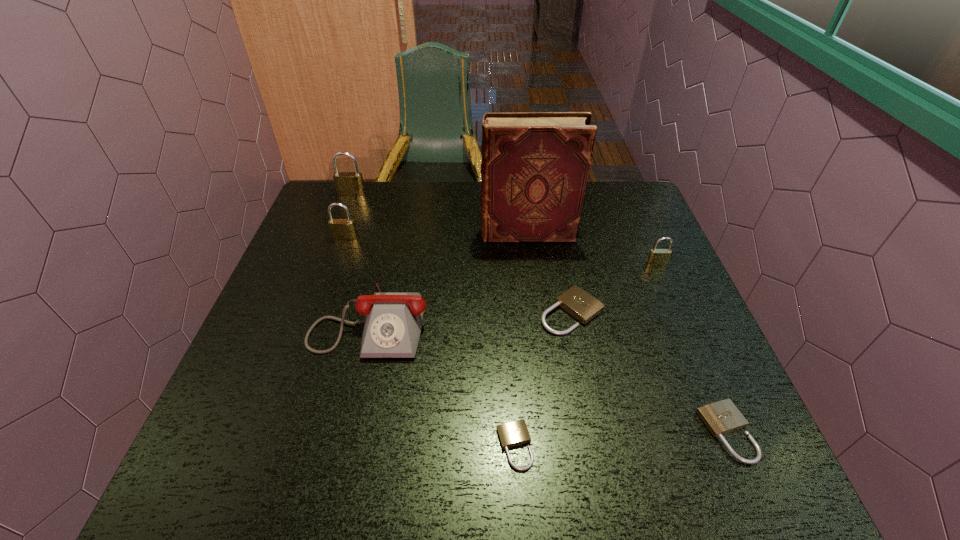
You are a GUI agent. You are given a task and a screenshot of the screen. Output one action in this format:
    pyautogui.click(x=<x>, y=<y>)
    Task: Click on the free spot between the shortest object and the telephone
    The image size is (960, 540).
    Given the screenshot: What is the action you would take?
    pyautogui.click(x=443, y=383)

Where is `vacant region between the red telephone and the leftmost beige padlock`? Image resolution: width=960 pixels, height=540 pixels. vacant region between the red telephone and the leftmost beige padlock is located at coordinates (443, 383).

Find the location of a particular element. This screenshot has height=540, width=960. free space between the second smallest brass padlock and the fourth shortest padlock is located at coordinates (501, 251).

The image size is (960, 540). Identify the location of vacant area that lies between the tallest object and the farthest padlock. (440, 214).

Where is `free spot between the red telephone and the second farthest brass padlock`? free spot between the red telephone and the second farthest brass padlock is located at coordinates (358, 279).

At what (x,y) coordinates should I click in order to perform the action: click on free space between the fourth padlock from left to right and the shortest padlock. Please return your answer as a coordinate pair (x, y). The image size is (960, 540). Looking at the image, I should click on (543, 379).

The height and width of the screenshot is (540, 960). I want to click on object that ranks as the sixth closest to the rightmost brass padlock, so click(x=341, y=229).

Identify which object is located as the sixth nearest to the fifth shortest padlock. Please provide its 2D coordinates. Your answer should be formatted as a tuple, i.e. [(x, y)], where the tuple contains the x and y coordinates of a point satisfying the conditions above.

[(657, 256)]

Where is `padlock that is the fifth closest one to the telephone`? The height and width of the screenshot is (540, 960). padlock that is the fifth closest one to the telephone is located at coordinates (721, 417).

This screenshot has width=960, height=540. What are the coordinates of `padlock that is the third closest to the fourth nearest padlock` in the screenshot? It's located at (515, 433).